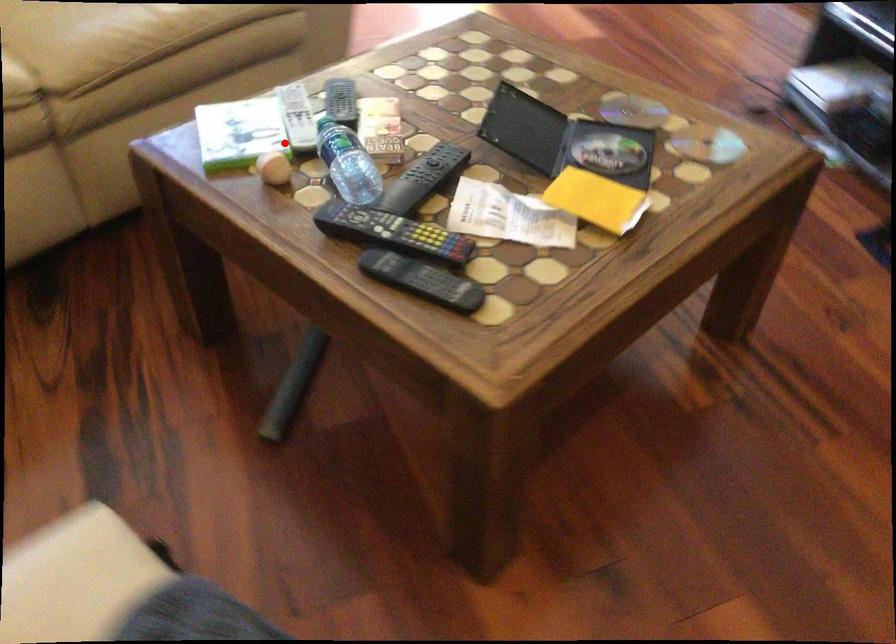
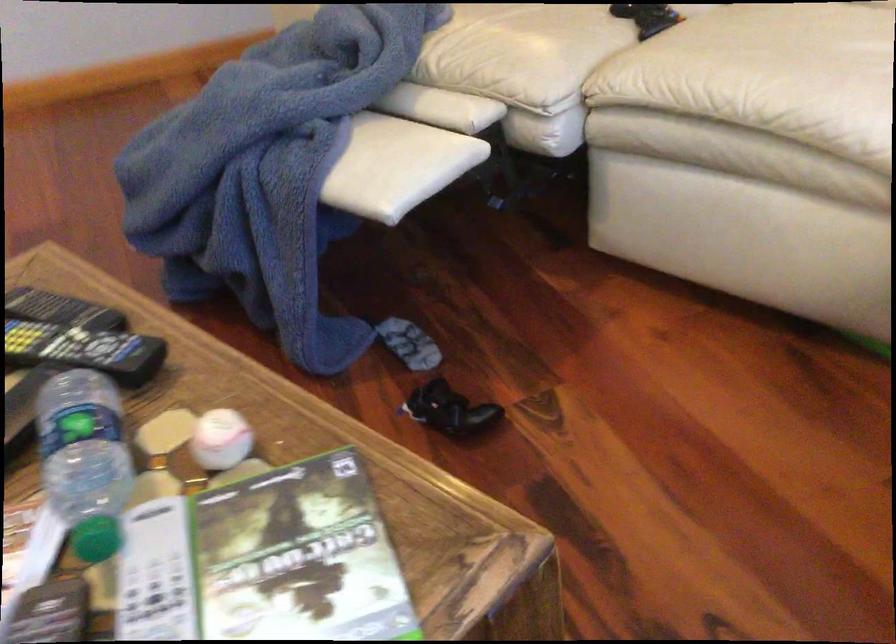
Question: A red point is marked in image1. In image2, is the corresponding 3D point closer to the camera or farther? Reply with the corresponding letter.

Choices:
 (A) The corresponding 3D point is closer.
 (B) The corresponding 3D point is farther.

Answer: (A)